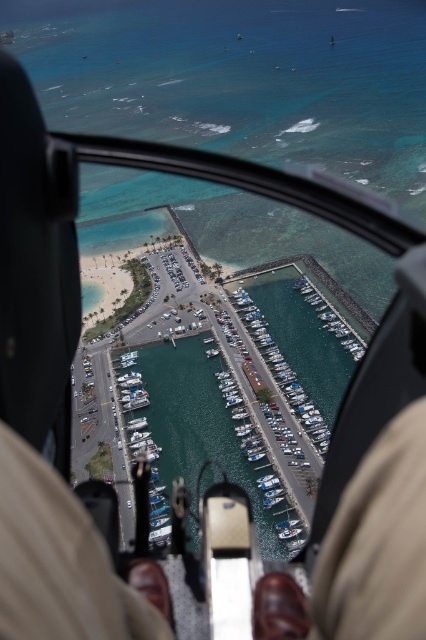
Question: Which object is the closest to the brown leather shoes at lower center?

Choices:
 (A) white plastic boats at center
 (B) white glossy boats at center

Answer: (A)

Question: Can you confirm if brown leather shoes at lower center is smaller than white plastic boats at center?

Choices:
 (A) no
 (B) yes

Answer: (B)

Question: Which object is positioned closest to the white plastic boats at center?

Choices:
 (A) brown leather shoes at lower center
 (B) white glossy boats at center

Answer: (B)

Question: Is brown leather shoes at lower center to the right of white plastic boats at center from the viewer's perspective?

Choices:
 (A) yes
 (B) no

Answer: (B)

Question: Is brown leather shoes at lower center bigger than white plastic boats at center?

Choices:
 (A) no
 (B) yes

Answer: (A)

Question: Which object is positioned closest to the white plastic boats at center?

Choices:
 (A) white glossy boats at center
 (B) brown leather shoes at lower center

Answer: (A)